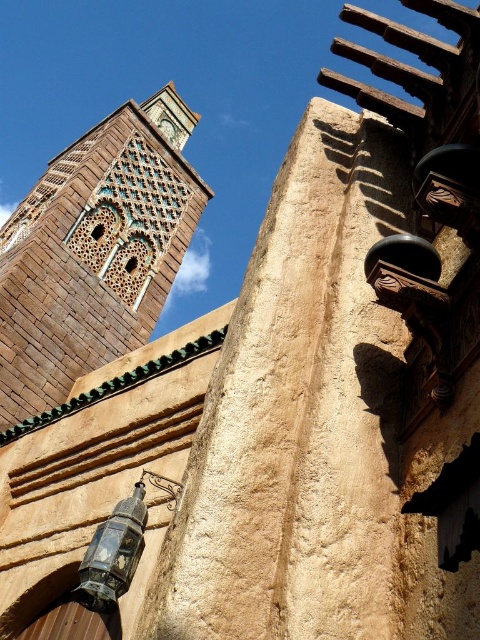
You are standing at the base of the tall, slender tower with intricate geometric patterns and decorative details on the left side of the building. You want to place a small flag exactly at point (72, 144). If the flag is 3 feet tall, will it be visible from your current position?

The point (72, 144) is 614.98 feet away from the camera. Since the flag is only 3 feet tall, it may not be visible from that distance due to its small size compared to the distance. However, the exact visibility would depend on factors like lighting and clarity, but based on distance alone, it might be too small to see clearly.

You are standing in front of a building with a brown textured stone tower at upper left. There is a point marked at coordinates (94,252). Based on the scene description, where is this point located?

The point at coordinates (94,252) corresponds to the brown textured stone tower at upper left.

You are an architect planning to install a new decorative element between the brown textured stone tower at upper left and the green stone clock at upper center. The element requires a minimum of 30 meters of space between them to be installed safely. Based on the image, can you confirm if there is enough space?

The distance between the brown textured stone tower at upper left and the green stone clock at upper center is 33.31 meters, which exceeds the required 30 meters. Therefore, there is sufficient space to install the decorative element safely.